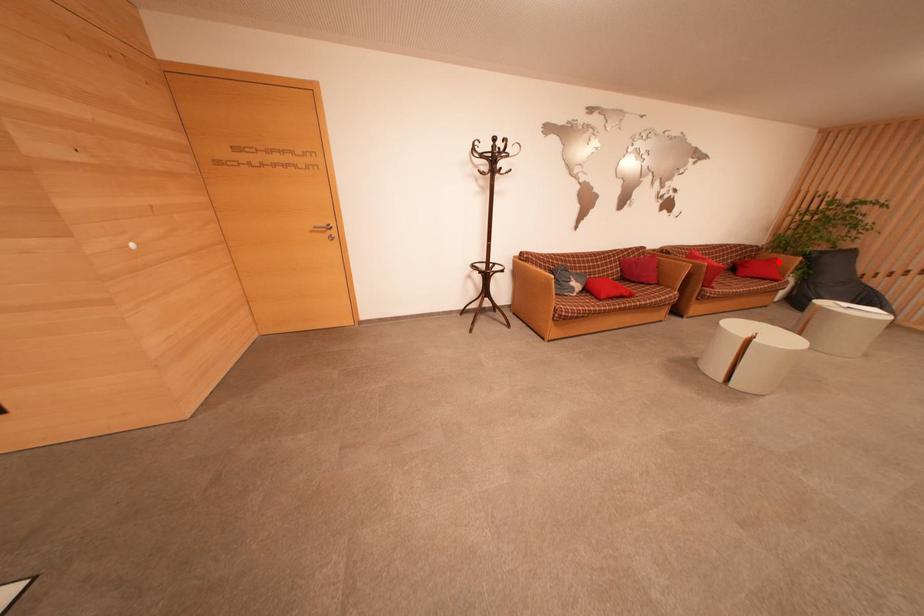
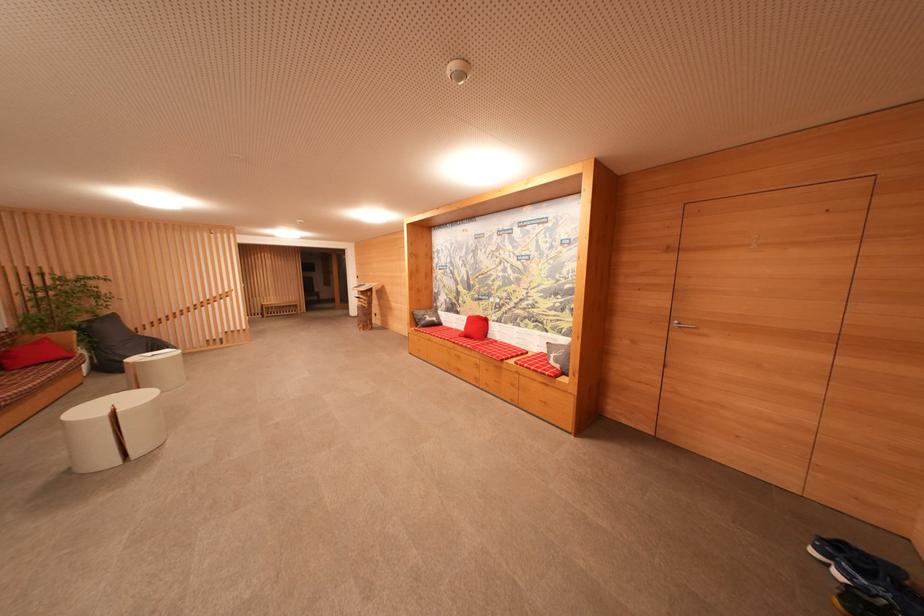
The point at the highlighted location is marked in the first image. Where is the corresponding point in the second image?

(50, 342)